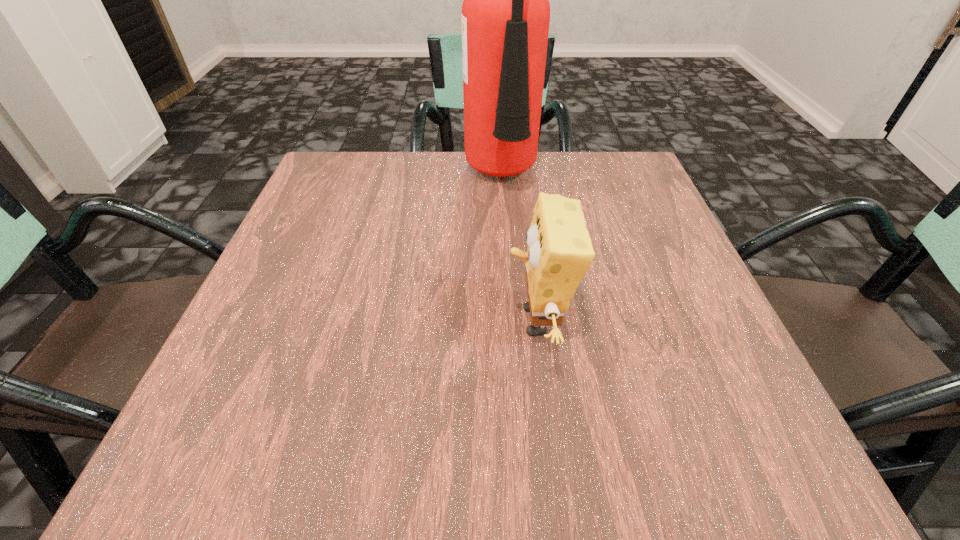
The width and height of the screenshot is (960, 540). I want to click on vacant region at the near edge of the desktop, so click(x=411, y=434).

This screenshot has height=540, width=960. I want to click on vacant space at the left edge of the desktop, so click(x=323, y=379).

I want to click on free space at the right edge of the desktop, so click(659, 353).

Identify the location of free space at the far left corner of the desktop. The height and width of the screenshot is (540, 960). (345, 168).

Find the location of a particular element. This screenshot has height=540, width=960. vacant space at the near left corner is located at coordinates (191, 443).

In the image, there is a desktop. Where is `vacant space at the far right corner`? vacant space at the far right corner is located at coordinates (586, 152).

This screenshot has height=540, width=960. In the image, there is a desktop. Identify the location of vacant space at the near right corner. (713, 413).